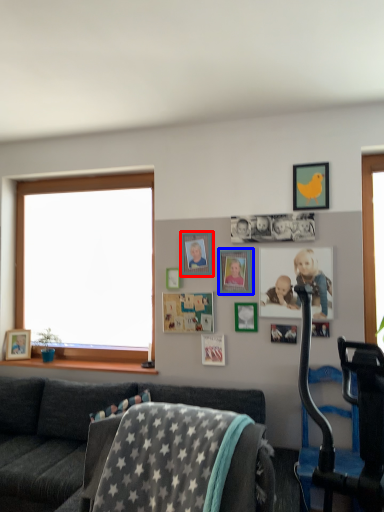
Question: Among these objects, which one is nearest to the camera, picture frame (highlighted by a red box) or picture frame (highlighted by a blue box)?

Choices:
 (A) picture frame
 (B) picture frame

Answer: (B)